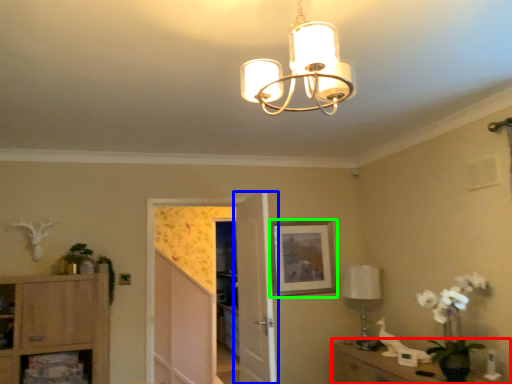
Question: Estimate the real-world distances between objects in this image. Which object is closer to vanity (highlighted by a red box), door (highlighted by a blue box) or picture frame (highlighted by a green box)?

Choices:
 (A) door
 (B) picture frame

Answer: (B)